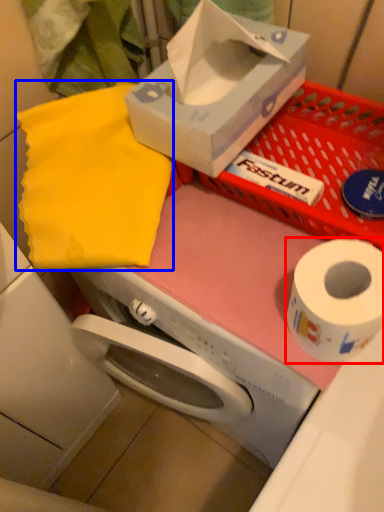
Question: Which of the following is the closest to the observer, toilet paper (highlighted by a red box) or cloth (highlighted by a blue box)?

Choices:
 (A) toilet paper
 (B) cloth

Answer: (A)